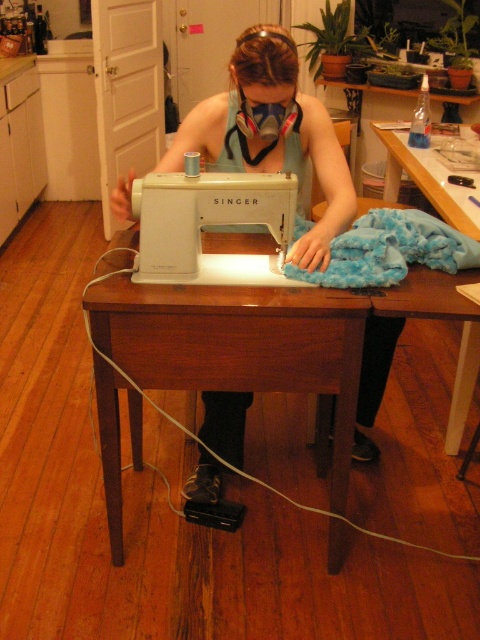
You are a furniture designer who needs to place a 1.5 meter tall sculpture on the table that can support it. Which table should you choose between the brown wood table at center and the wooden table at lower right?

The brown wood table at center has a greater height compared to wooden table at lower right, so you should choose the brown wood table at center to place the 1.5 meter tall sculpture as it is taller and likely has enough space.

You are a person who wants to place a small tool on the table near the sewing machine. The sewing machine is at point (271, 134). Where should you place the tool so that it is closest to the sewing machine but still on the table?

The tool should be placed as close as possible to the point (271, 134), which is the location of the matte white sewing machine at center, to ensure it is nearest to the sewing machine while remaining on the table.

You are a robot arm trying to pick up the matte white sewing machine at center. What are the coordinates you should move to in order to reach it?

The coordinates to reach the matte white sewing machine at center are at point (271,134).